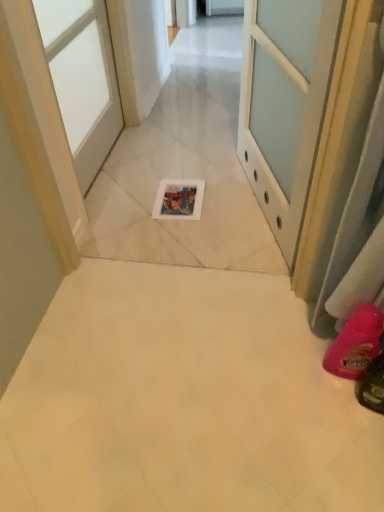
Locate an element on the screen. free location in front of pink rubber boot at lower right is located at coordinates (344, 426).